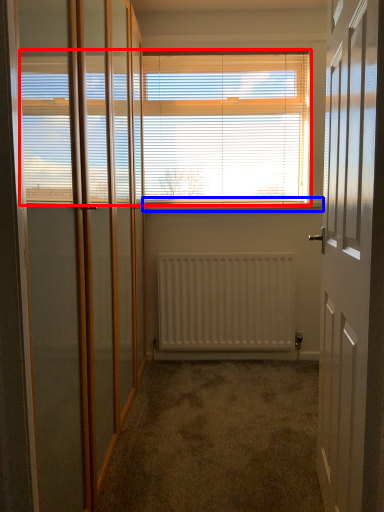
Question: Among these objects, which one is nearest to the camera, window blind (highlighted by a red box) or window sill (highlighted by a blue box)?

Choices:
 (A) window blind
 (B) window sill

Answer: (A)